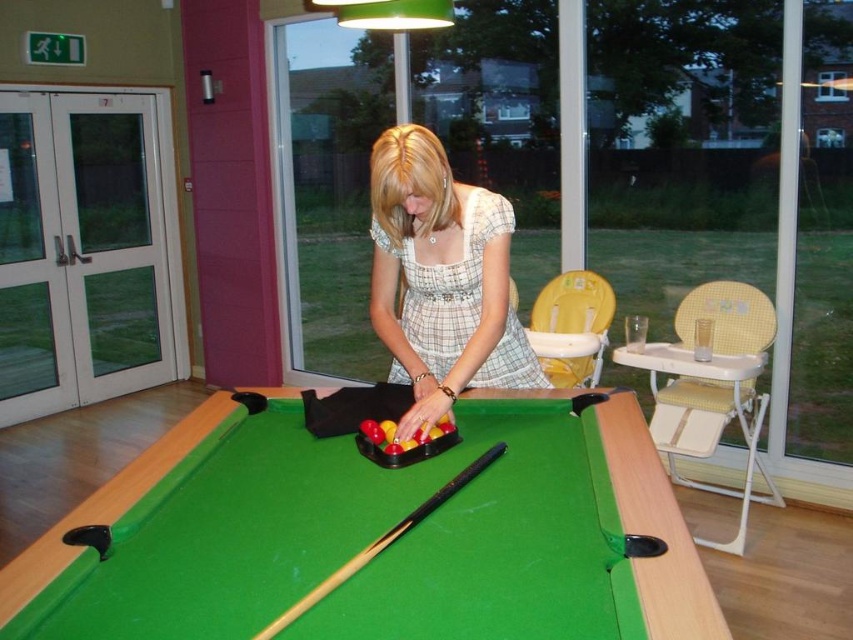
Question: Which point is closer to the camera?

Choices:
 (A) (392, 529)
 (B) (701, 579)
 (C) (437, 257)

Answer: (B)

Question: Is green felt billiard table at center above wooden smooth cue at center?

Choices:
 (A) no
 (B) yes

Answer: (B)

Question: Is green felt billiard table at center positioned before wooden smooth cue at center?

Choices:
 (A) no
 (B) yes

Answer: (B)

Question: Does green felt billiard table at center appear under white checkered dress at center?

Choices:
 (A) no
 (B) yes

Answer: (B)

Question: Which object appears closest to the camera in this image?

Choices:
 (A) green felt billiard table at center
 (B) white checkered dress at center
 (C) wooden smooth cue at center

Answer: (A)

Question: Which of the following is the farthest from the observer?

Choices:
 (A) (566, 582)
 (B) (471, 330)
 (C) (463, 484)

Answer: (B)